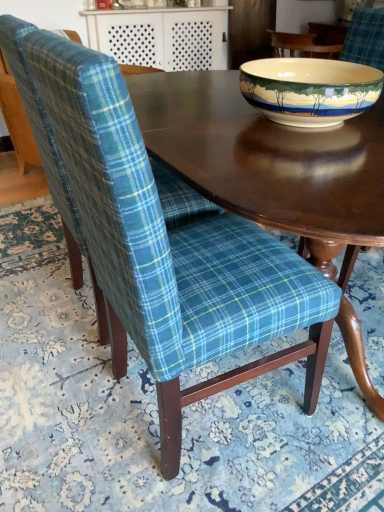
At what (x,y) coordinates should I click in order to perform the action: click on vacant space in front of porcelain bowl at upper right. Please return your answer as a coordinate pair (x, y). Looking at the image, I should click on (296, 161).